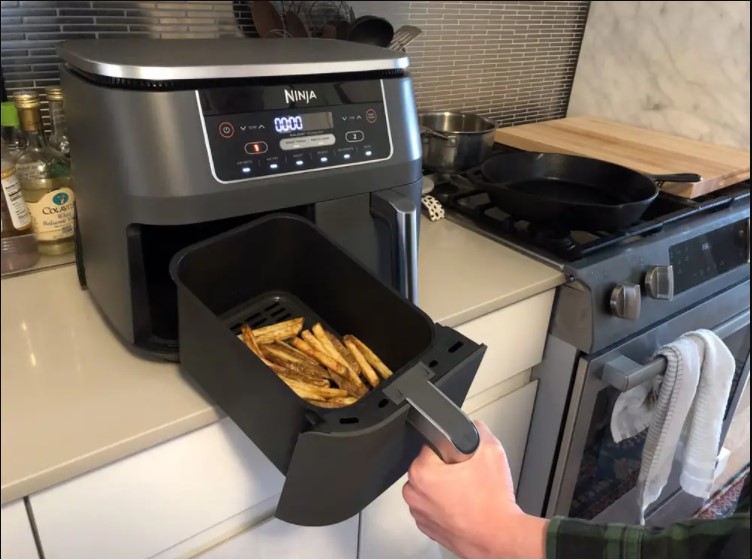
The image size is (752, 560). Find the location of `pot`. pot is located at coordinates (467, 141).